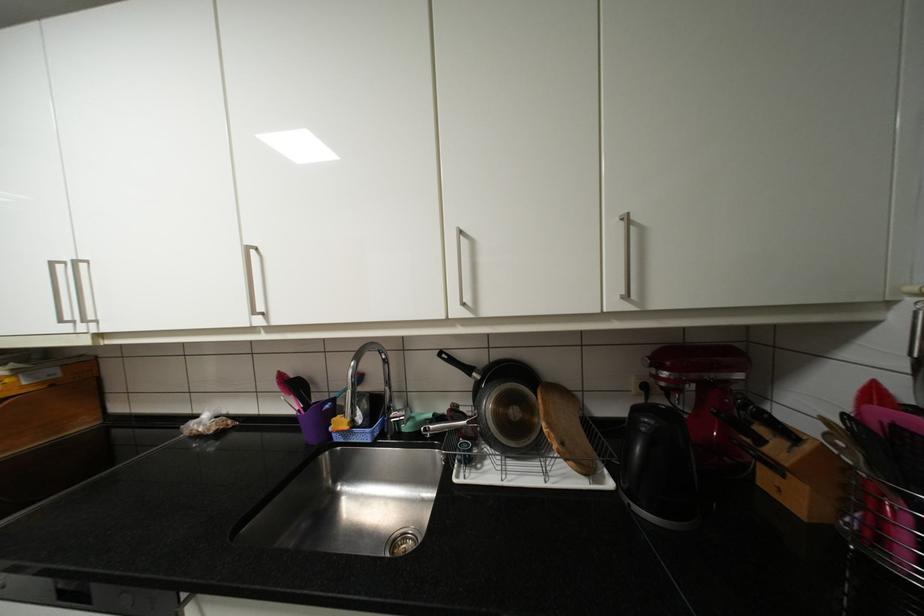
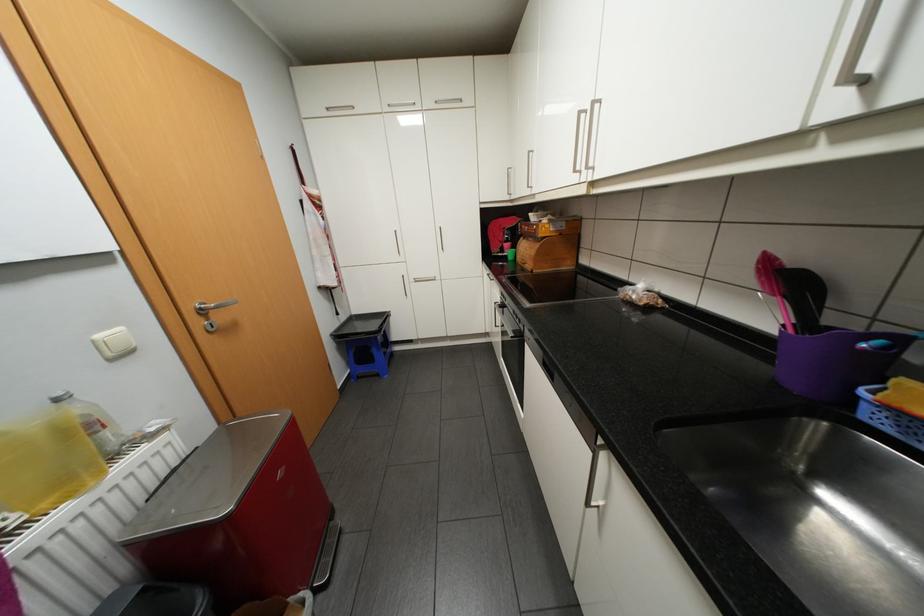
Locate, in the second image, the point that corresponds to the point at 304,385 in the first image.

(800, 283)